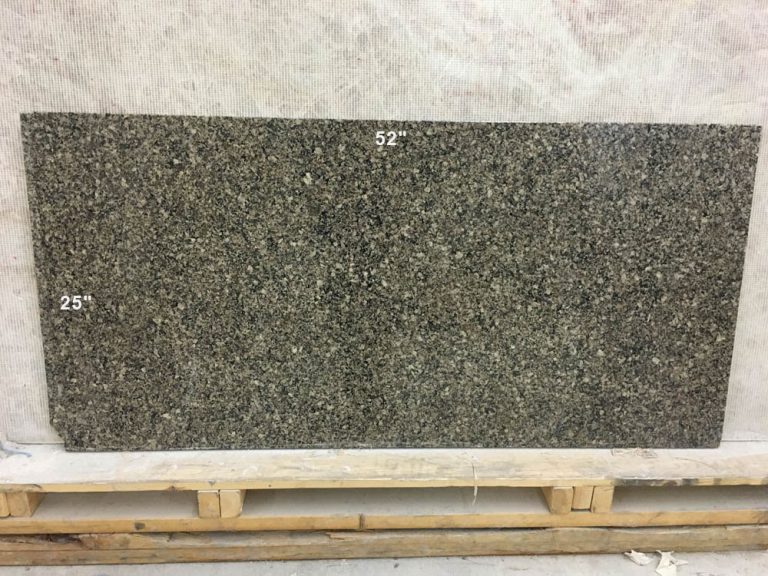
The image size is (768, 576). I want to click on wall, so click(656, 55).